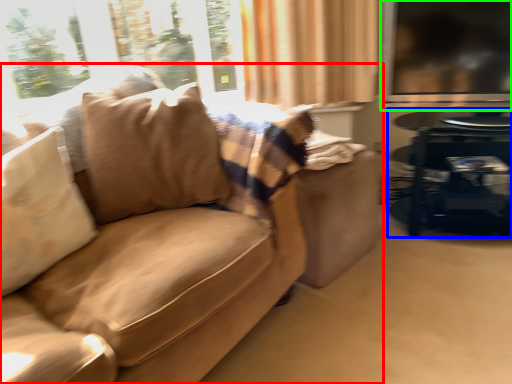
Question: Considering the real-world distances, which object is farthest from studio couch (highlighted by a red box)? table (highlighted by a blue box) or window screen (highlighted by a green box)?

Choices:
 (A) table
 (B) window screen

Answer: (B)